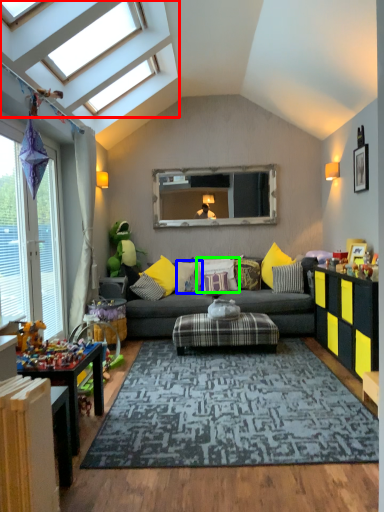
Question: Considering the real-world distances, which object is closest to window (highlighted by a red box)? pillow (highlighted by a blue box) or pillow (highlighted by a green box).

Choices:
 (A) pillow
 (B) pillow

Answer: (A)